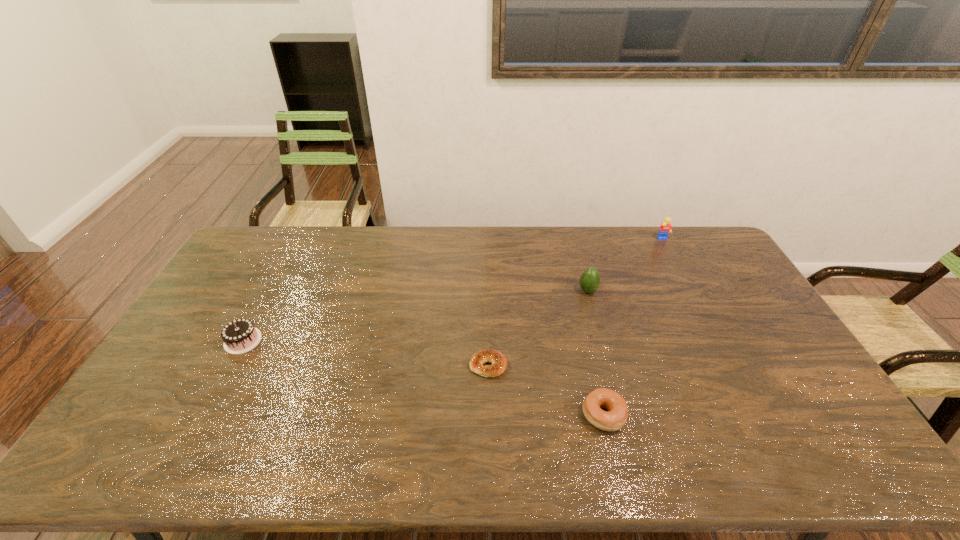
This screenshot has width=960, height=540. In order to click on Lego in this screenshot , I will do (665, 228).

Locate an element on the screen. This screenshot has width=960, height=540. the farthest object is located at coordinates (665, 228).

You are a GUI agent. You are given a task and a screenshot of the screen. Output one action in this format:
    pyautogui.click(x=<x>, y=<y>)
    Task: Click on the avocado
    The height and width of the screenshot is (540, 960).
    Given the screenshot: What is the action you would take?
    pyautogui.click(x=589, y=281)

This screenshot has width=960, height=540. I want to click on the leftmost object, so click(239, 336).

Image resolution: width=960 pixels, height=540 pixels. In order to click on the right bagel in this screenshot , I will do `click(616, 417)`.

The width and height of the screenshot is (960, 540). Find the location of `the second shortest object`. the second shortest object is located at coordinates (616, 417).

Locate an element on the screen. This screenshot has height=540, width=960. the left bagel is located at coordinates (499, 363).

The width and height of the screenshot is (960, 540). Find the location of `the farther bagel`. the farther bagel is located at coordinates (499, 363).

The height and width of the screenshot is (540, 960). In order to click on blank space located 0.210m on the face of the rightmost object in this screenshot , I will do `click(684, 279)`.

Locate an element on the screen. This screenshot has width=960, height=540. vacant region located 0.310m on the right of the fourth nearest object is located at coordinates (689, 291).